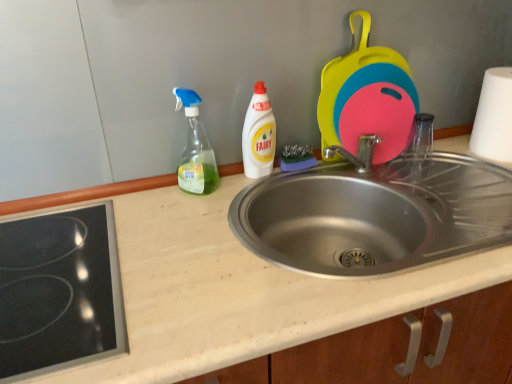
Question: In the image, is silicone cutting boards at upper right positioned in front of or behind white matte paper towel at right?

Choices:
 (A) front
 (B) behind

Answer: (A)

Question: From their relative heights in the image, would you say silicone cutting boards at upper right is taller or shorter than white matte paper towel at right?

Choices:
 (A) tall
 (B) short

Answer: (A)

Question: Estimate the real-world distances between objects in this image. Which object is farther from the black glass cooktop at lower left?

Choices:
 (A) white plastic bottle at center, which is the first bottle from right to left
 (B) beige laminate counter top at center
 (C) white matte paper towel at right
 (D) transparent plastic spray bottle at center, the 2th bottle in the right-to-left sequence
 (E) stainless steel sink at center

Answer: (C)

Question: Which is nearer to the white plastic bottle at center, which is the first bottle from right to left?

Choices:
 (A) stainless steel sink at center
 (B) black glass cooktop at lower left
 (C) silicone cutting boards at upper right
 (D) white matte paper towel at right
 (E) beige laminate counter top at center

Answer: (C)